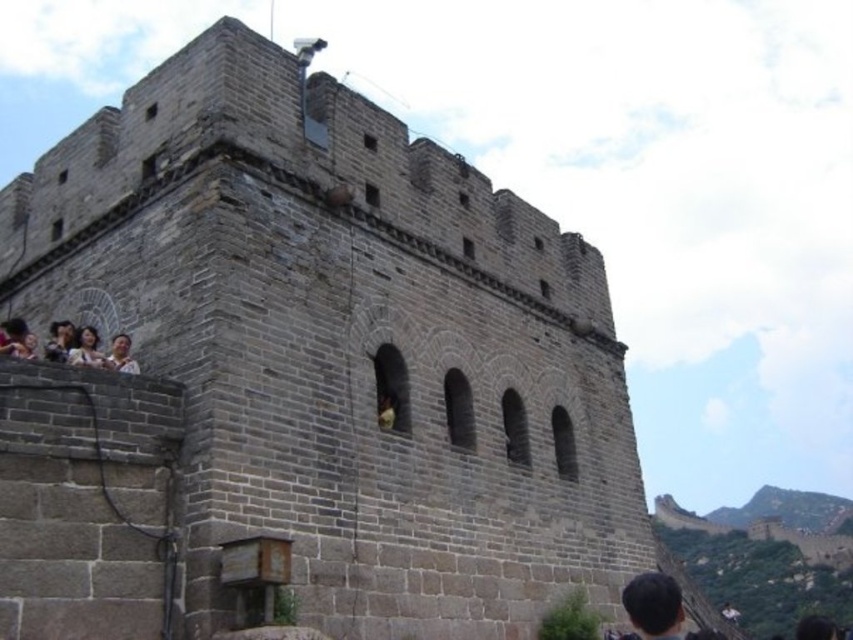
Who is positioned more to the left, matte gray hair at left or matte gray face at lower left?

matte gray hair at left is more to the left.

Does point (94, 362) come closer to viewer compared to point (111, 348)?

That is True.

What are the coordinates of `matte gray hair at left` in the screenshot? It's located at (86, 348).

Does light brown wooden chair at left have a lesser width compared to matte gray face at lower left?

Yes, light brown wooden chair at left is thinner than matte gray face at lower left.

Does light brown wooden chair at left have a larger size compared to matte gray face at lower left?

No.

Is point (65, 355) less distant than point (115, 362)?

No.

The width and height of the screenshot is (853, 640). What are the coordinates of `light brown wooden chair at left` in the screenshot? It's located at (59, 340).

What do you see at coordinates (86, 348) in the screenshot? The image size is (853, 640). I see `matte gray hair at left` at bounding box center [86, 348].

Who is more forward, (90,356) or (57,323)?

Positioned in front is point (90,356).

The image size is (853, 640). What are the coordinates of `matte gray hair at left` in the screenshot? It's located at (86, 348).